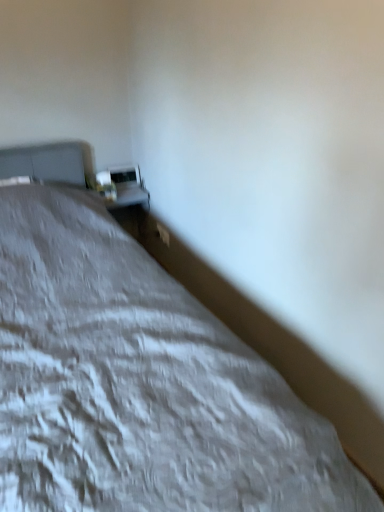
Find the location of `white textured bed at center`. white textured bed at center is located at coordinates (135, 374).

Locate an element on the screen. The width and height of the screenshot is (384, 512). matte white table lamp at upper left is located at coordinates (105, 186).

Can you confirm if matte white table lamp at upper left is taller than white glossy table at upper center?

In fact, matte white table lamp at upper left may be shorter than white glossy table at upper center.

Is matte white table lamp at upper left positioned behind white glossy table at upper center?

No, matte white table lamp at upper left is closer to the viewer.

From the image's perspective, is matte white table lamp at upper left above white glossy table at upper center?

Yes, from the image's perspective, matte white table lamp at upper left is over white glossy table at upper center.

Is white textured bed at center completely or partially inside white glossy table at upper center?

No.

Does point (134, 194) come farther from viewer compared to point (60, 216)?

Yes, point (134, 194) is farther from viewer.

Which of these two, white glossy table at upper center or white textured bed at center, stands taller?

With more height is white textured bed at center.

From the image's perspective, which is below, white glossy table at upper center or matte white table lamp at upper left?

white glossy table at upper center is shown below in the image.

Does white glossy table at upper center turn towards matte white table lamp at upper left?

No.

How different are the orientations of white glossy table at upper center and matte white table lamp at upper left in degrees?

The angle between the facing direction of white glossy table at upper center and the facing direction of matte white table lamp at upper left is 0.000678 degrees.

How different are the orientations of white textured bed at center and white glossy table at upper center in degrees?

There is a 0.774-degree angle between the facing directions of white textured bed at center and white glossy table at upper center.

Does white textured bed at center touch white glossy table at upper center?

white textured bed at center and white glossy table at upper center are not in contact.

Locate an element on the screen. This screenshot has width=384, height=512. table on the left side of white textured bed at center is located at coordinates (131, 207).

Which object is thinner, matte white table lamp at upper left or white textured bed at center?

matte white table lamp at upper left is thinner.

Would you say matte white table lamp at upper left is to the left or to the right of white textured bed at center in the picture?

matte white table lamp at upper left is positioned on white textured bed at center's left side.

Is the surface of matte white table lamp at upper left in direct contact with white textured bed at center?

matte white table lamp at upper left is not next to white textured bed at center, and they're not touching.

Would you consider white textured bed at center to be distant from matte white table lamp at upper left?

No, white textured bed at center is not far from matte white table lamp at upper left.

Does point (122, 290) come behind point (112, 199)?

No, it is in front of (112, 199).

Does white textured bed at center have a smaller size compared to matte white table lamp at upper left?

Actually, white textured bed at center might be larger than matte white table lamp at upper left.

From the image's perspective, between white textured bed at center and matte white table lamp at upper left, who is located below?

From the image's view, white textured bed at center is below.

This screenshot has width=384, height=512. What are the coordinates of `table lying on the right of matte white table lamp at upper left` in the screenshot? It's located at (131, 207).

Identify the location of bed above the white glossy table at upper center (from a real-world perspective). (135, 374).

Estimate the real-world distances between objects in this image. Which object is closer to white textured bed at center, white glossy table at upper center or matte white table lamp at upper left?

matte white table lamp at upper left is closer to white textured bed at center.

Consider the image. Based on their spatial positions, is white textured bed at center or white glossy table at upper center closer to matte white table lamp at upper left?

The object closer to matte white table lamp at upper left is white glossy table at upper center.

Estimate the real-world distances between objects in this image. Which object is closer to white glossy table at upper center, white textured bed at center or matte white table lamp at upper left?

Among the two, matte white table lamp at upper left is located nearer to white glossy table at upper center.

When comparing their distances from white textured bed at center, does matte white table lamp at upper left or white glossy table at upper center seem closer?

matte white table lamp at upper left is positioned closer to the anchor white textured bed at center.

From the image, which object appears to be farther from matte white table lamp at upper left, white glossy table at upper center or white textured bed at center?

white textured bed at center.

Which object lies nearer to the anchor point white glossy table at upper center, matte white table lamp at upper left or white textured bed at center?

The object closer to white glossy table at upper center is matte white table lamp at upper left.

Locate an element on the screen. table lamp between white textured bed at center and white glossy table at upper center along the z-axis is located at coordinates (105, 186).